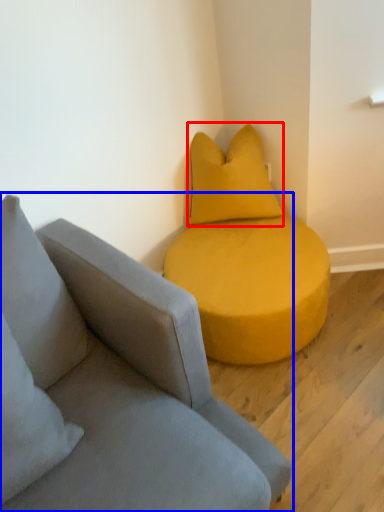
Question: Among these objects, which one is nearest to the camera, pillow (highlighted by a red box) or studio couch (highlighted by a blue box)?

Choices:
 (A) pillow
 (B) studio couch

Answer: (B)